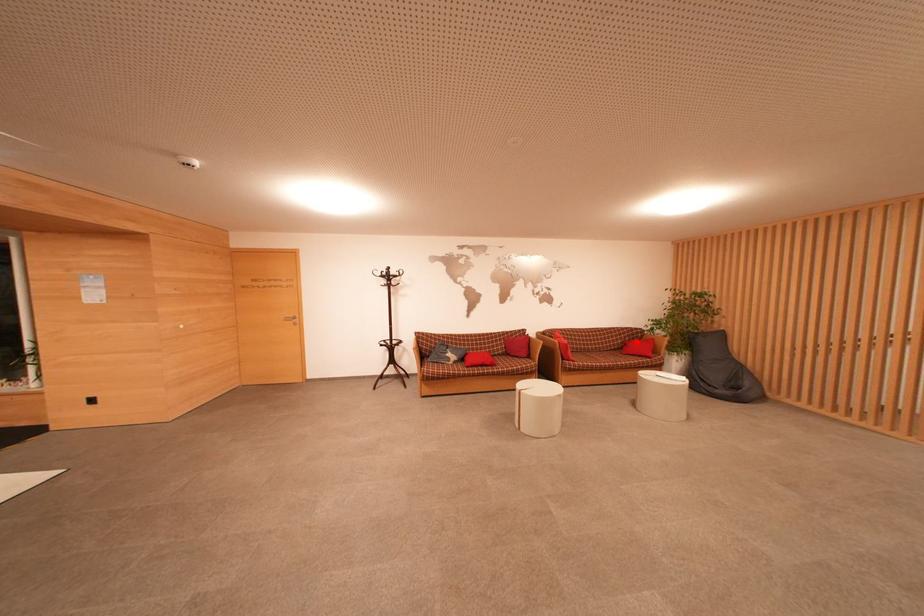
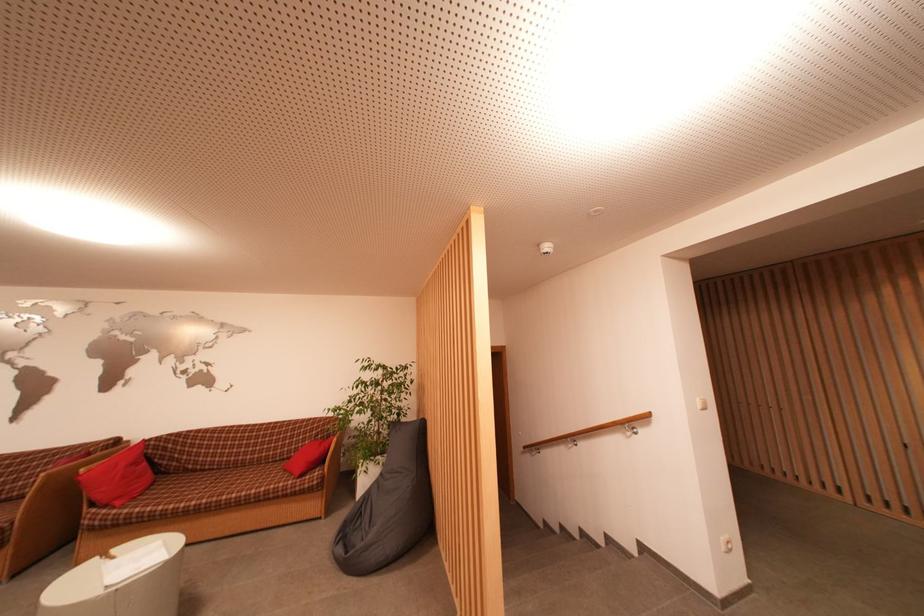
Where in the second image is the point corresponding to the highlighted location from the first image?

(333, 439)